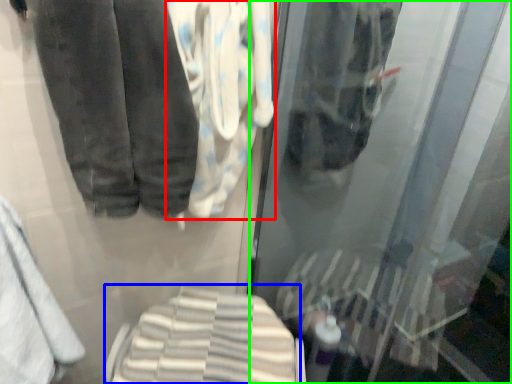
Question: Estimate the real-world distances between objects in this image. Which object is farther from cloth (highlighted by a red box), cloth (highlighted by a blue box) or shop window (highlighted by a green box)?

Choices:
 (A) cloth
 (B) shop window

Answer: (A)